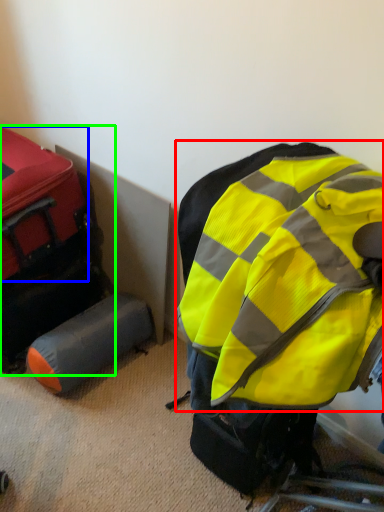
Question: Which object is positioned closest to backpack (highlighted by a red box)? Select from luggage (highlighted by a blue box) and luggage and bags (highlighted by a green box).

Choices:
 (A) luggage
 (B) luggage and bags

Answer: (A)